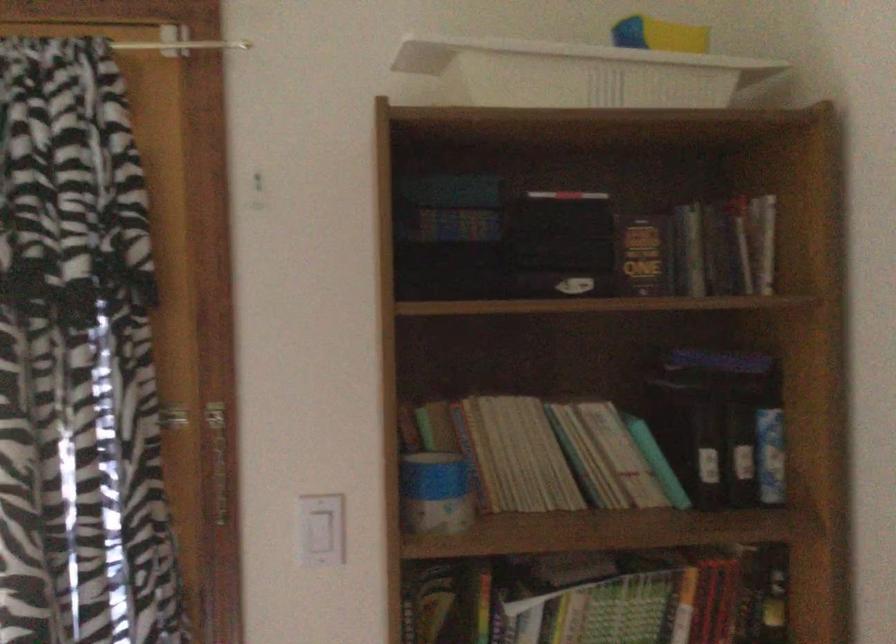
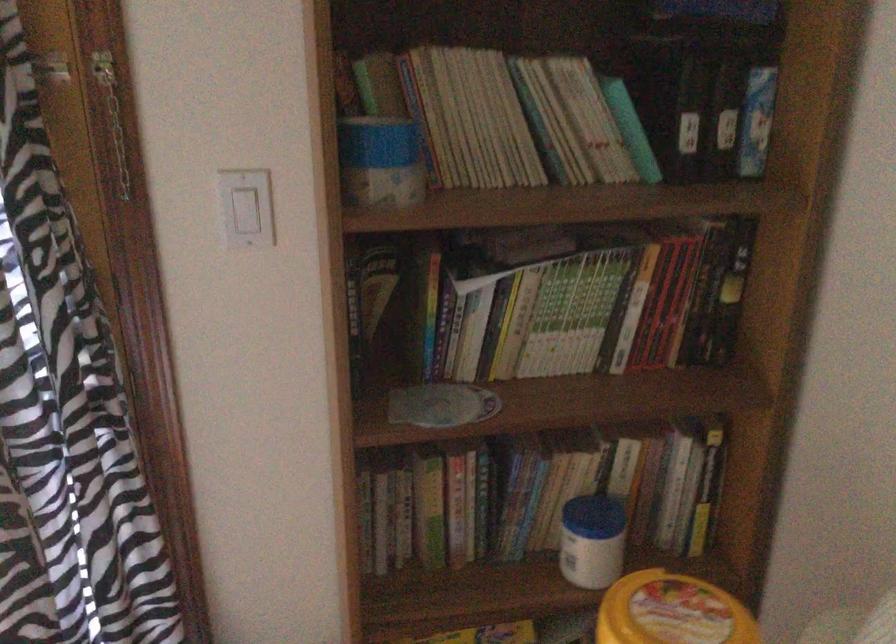
Question: The images are taken continuously from a first-person perspective. In which direction is your viewpoint rotating?

Choices:
 (A) Left
 (B) Right
 (C) Up
 (D) Down

Answer: (D)